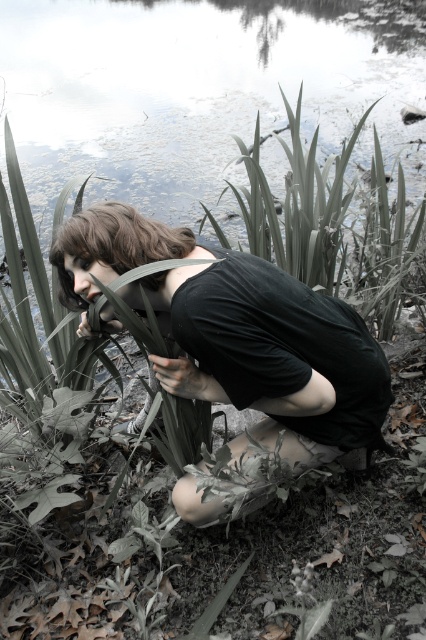
Question: Which object is closer to the camera taking this photo?

Choices:
 (A) dark brown hair at center
 (B) black matte shirt at center

Answer: (B)

Question: Which point is closer to the camera?

Choices:
 (A) dark brown hair at center
 (B) black matte shirt at center

Answer: (B)

Question: Is black matte shirt at center to the right of dark brown hair at center from the viewer's perspective?

Choices:
 (A) yes
 (B) no

Answer: (A)

Question: Which point is farther to the camera?

Choices:
 (A) (55, 252)
 (B) (327, 324)

Answer: (A)

Question: Is black matte shirt at center closer to camera compared to dark brown hair at center?

Choices:
 (A) yes
 (B) no

Answer: (A)

Question: Can you confirm if black matte shirt at center is positioned to the right of dark brown hair at center?

Choices:
 (A) no
 (B) yes

Answer: (B)